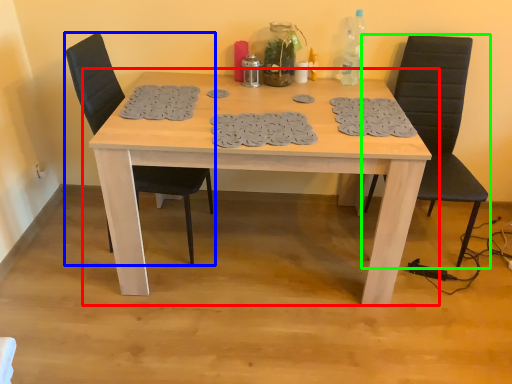
Question: Based on their relative distances, which object is farther from table (highlighted by a red box)? Choose from chair (highlighted by a blue box) and chair (highlighted by a green box).

Choices:
 (A) chair
 (B) chair

Answer: (B)